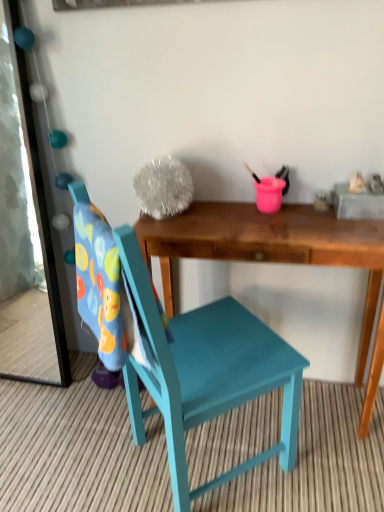
Question: Can you confirm if wooden desk at center is thinner than teal painted wood chair at center?

Choices:
 (A) no
 (B) yes

Answer: (B)

Question: Is the position of wooden desk at center more distant than that of teal painted wood chair at center?

Choices:
 (A) yes
 (B) no

Answer: (A)

Question: From the image's perspective, would you say wooden desk at center is shown under teal painted wood chair at center?

Choices:
 (A) yes
 (B) no

Answer: (B)

Question: Could teal painted wood chair at center be considered to be inside wooden desk at center?

Choices:
 (A) no
 (B) yes

Answer: (A)

Question: From a real-world perspective, does wooden desk at center sit lower than teal painted wood chair at center?

Choices:
 (A) no
 (B) yes

Answer: (B)

Question: Considering their positions, is metallic mirror at left located in front of or behind wooden desk at center?

Choices:
 (A) behind
 (B) front

Answer: (A)

Question: Considering the positions of point (16, 58) and point (324, 216), is point (16, 58) closer or farther from the camera than point (324, 216)?

Choices:
 (A) farther
 (B) closer

Answer: (A)

Question: In terms of height, does metallic mirror at left look taller or shorter compared to wooden desk at center?

Choices:
 (A) tall
 (B) short

Answer: (A)

Question: Do you think metallic mirror at left is within wooden desk at center, or outside of it?

Choices:
 (A) outside
 (B) inside

Answer: (A)

Question: Does point tap(160, 263) appear closer or farther from the camera than point tap(24, 339)?

Choices:
 (A) farther
 (B) closer

Answer: (B)

Question: Is wooden desk at center taller or shorter than metallic mirror at left?

Choices:
 (A) tall
 (B) short

Answer: (B)

Question: Is wooden desk at center in front of or behind metallic mirror at left in the image?

Choices:
 (A) front
 (B) behind

Answer: (A)

Question: From a real-world perspective, relative to metallic mirror at left, is wooden desk at center vertically above or below?

Choices:
 (A) below
 (B) above

Answer: (A)

Question: Based on their positions, is metallic mirror at left located to the left or right of teal painted wood chair at center?

Choices:
 (A) left
 (B) right

Answer: (A)

Question: Would you say metallic mirror at left is inside or outside teal painted wood chair at center?

Choices:
 (A) inside
 (B) outside

Answer: (B)